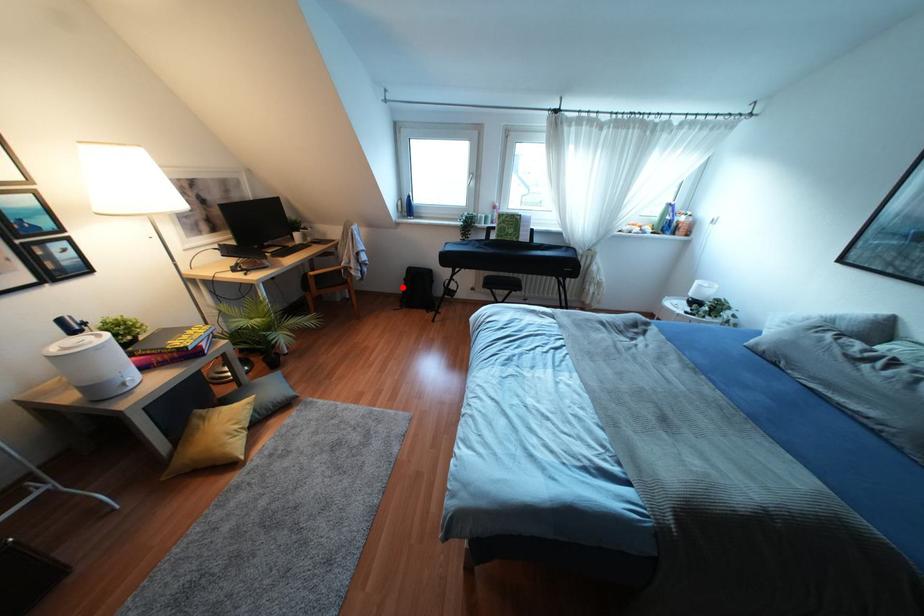
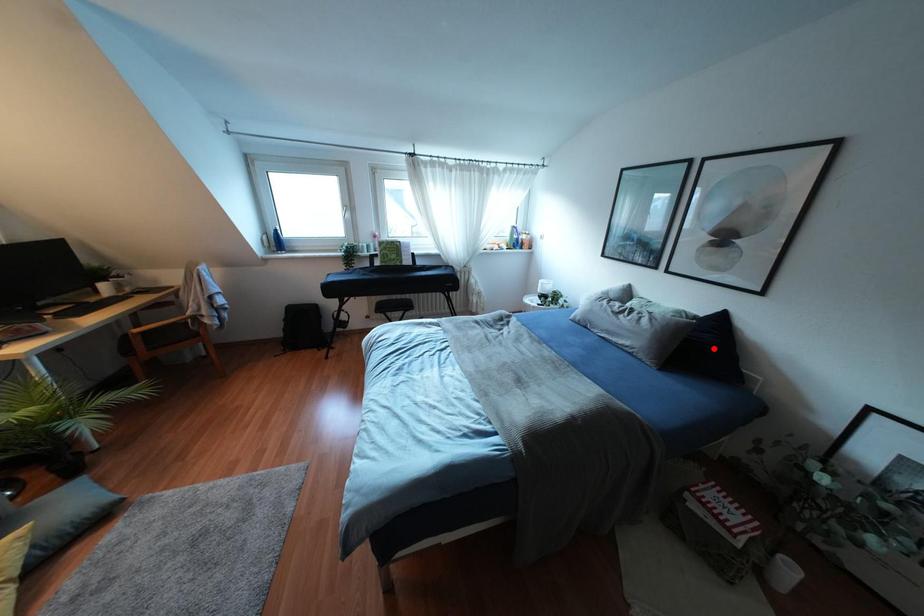
I am providing you with two images of the same scene from different viewpoints. A red point is marked on the first image and another point is marked on the second image. Is the red point in image1 aligned with the point shown in image2?

No